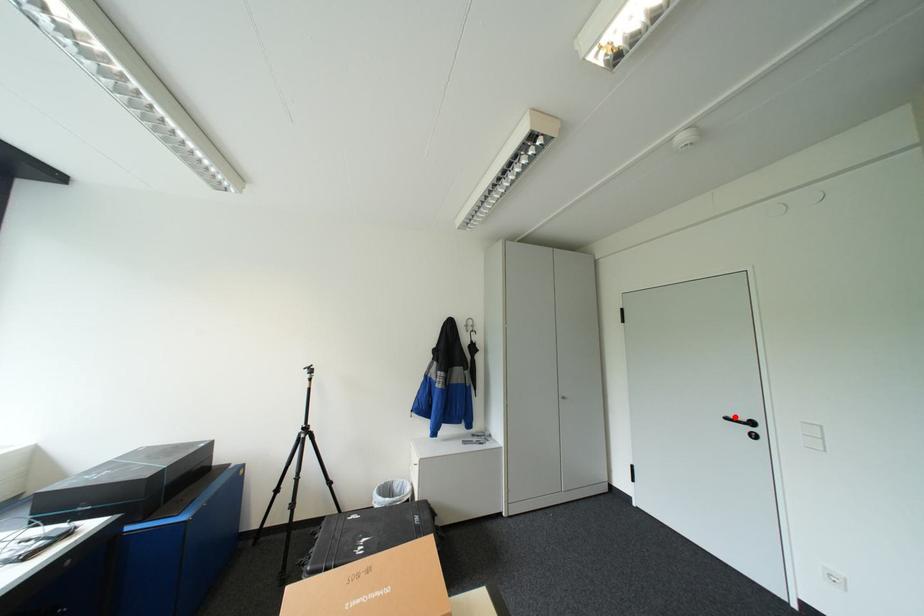
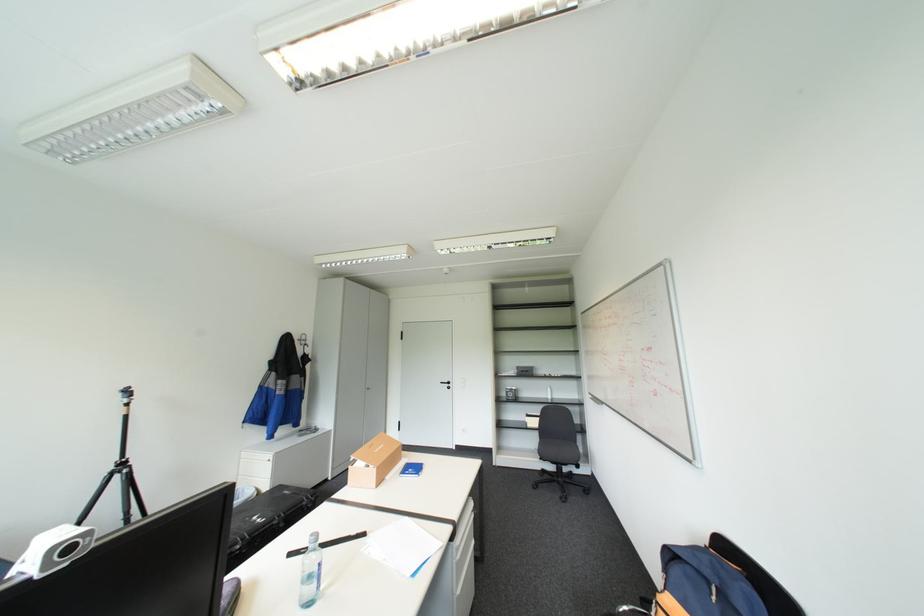
Where in the second image is the point corresponding to the highlighted location from the first image?

(450, 381)